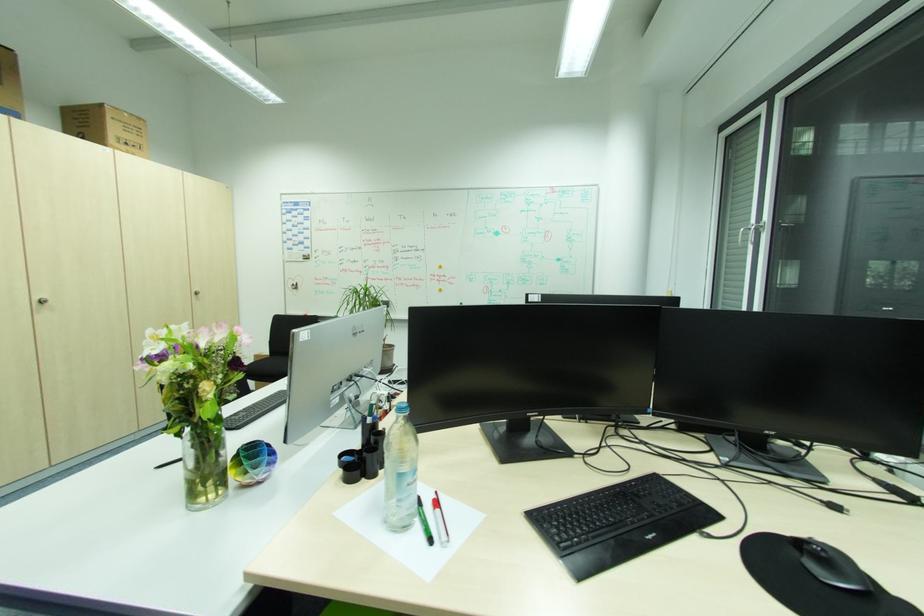
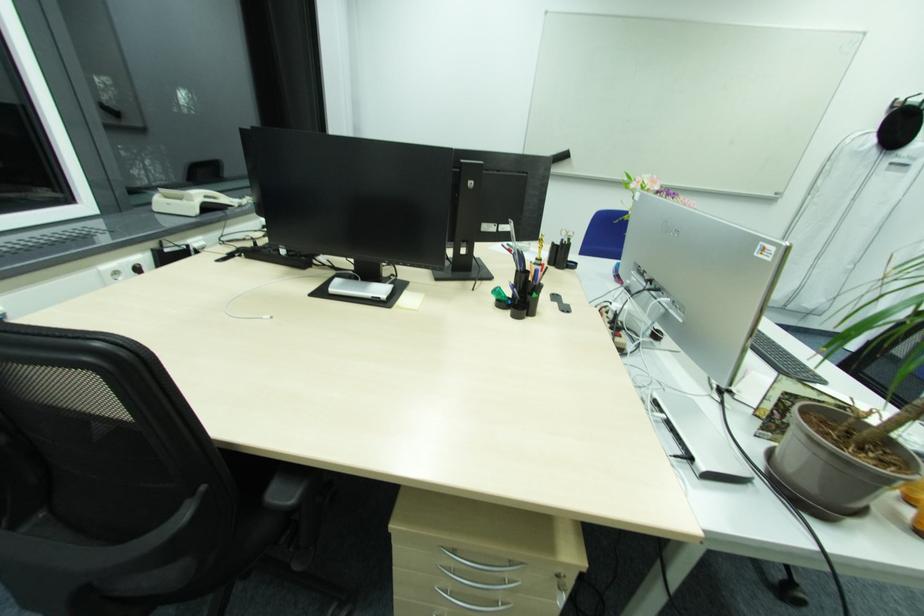
Question: I am providing you with two images of the same scene from different viewpoints. Please identify which objects are invisible in image2.

Choices:
 (A) cabinet lock
 (B) black pen holder
 (C) black chair sitting surface
 (D) white booklet

Answer: (B)